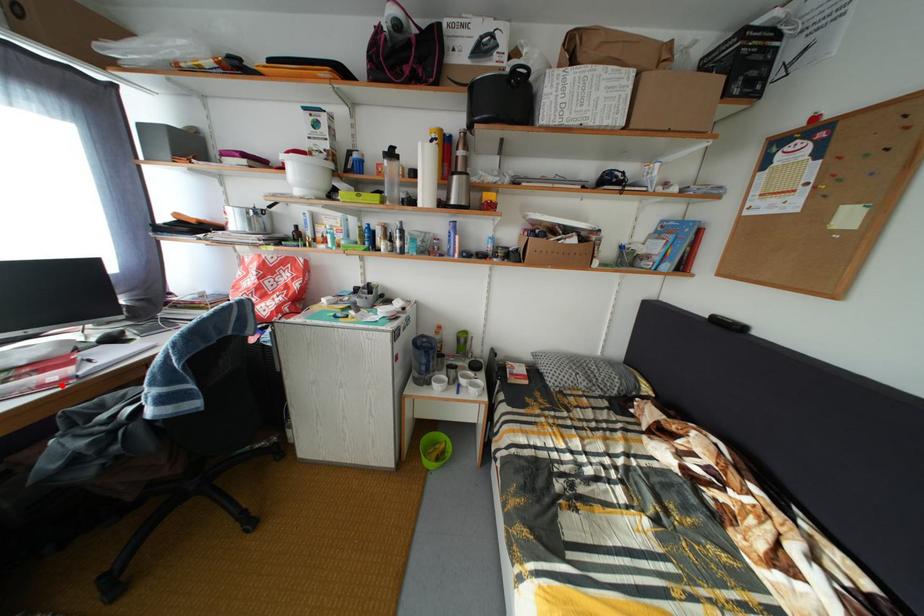
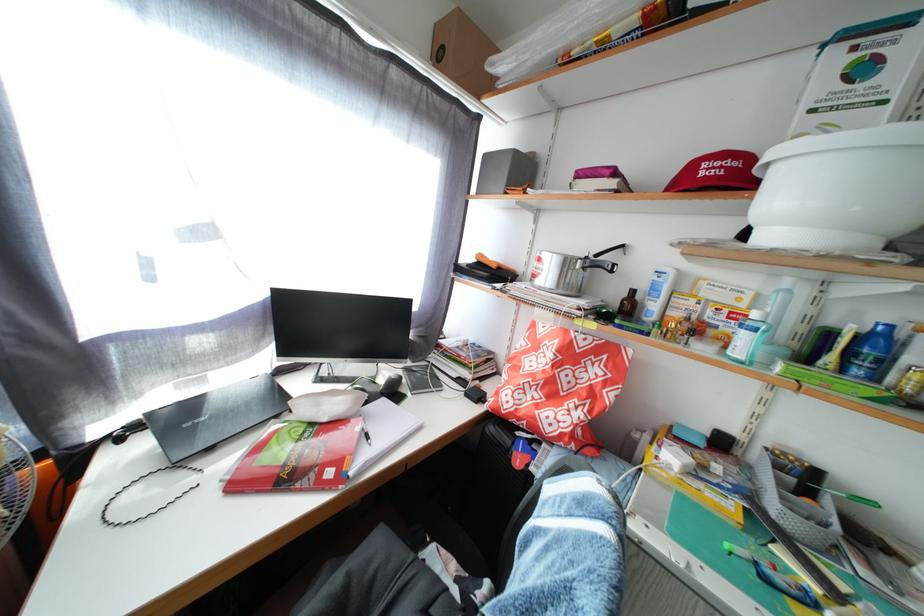
Question: I am providing you with two images of the same scene from different viewpoints. Image1 has a red point marked. In image2, the corresponding 3D location appears at what relative position? Reply with the corresponding letter.

Choices:
 (A) Closer
 (B) Farther

Answer: (B)